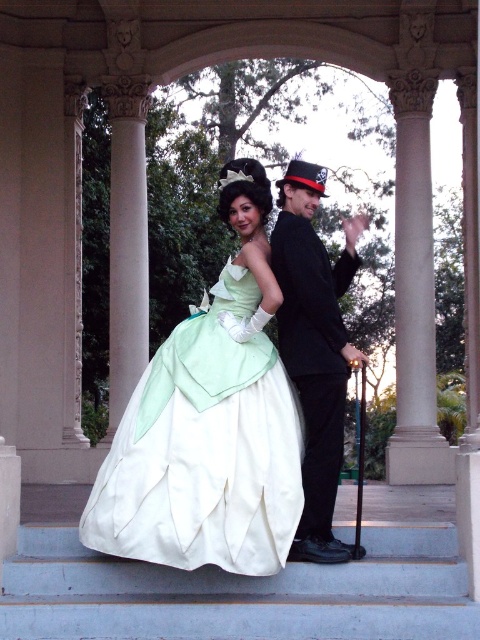
You are a photographer setting up a shoot in the scene described. You need to place a 10cm wide decorative item on the white smooth stairs at lower center and the shiny black suit at center. Which location can accommodate the item without it falling off?

The shiny black suit at center can accommodate the 10cm wide decorative item because the white smooth stairs at lower center is thinner than the shiny black suit at center, making the suit a wider and more stable surface.

You are standing at the camera position and want to take a photo of the two people in the image. If you move forward by 10 meters, will the point at coordinates point [157,371] become closer to you?

The point at coordinates point [157,371] is currently 26.56 meters away from the camera. If you move forward by 10 meters, your new distance to the point would be 26.56m minus 10m, which equals 16.56 meters. Therefore, the point would indeed become closer to you.